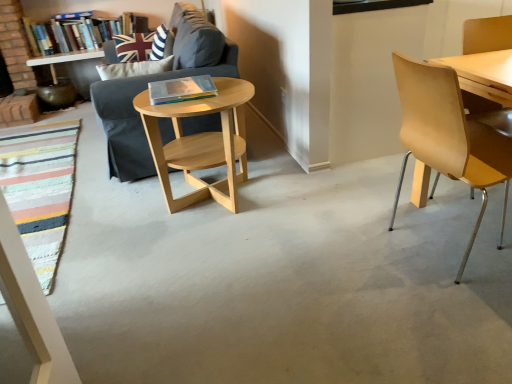
I want to click on hardcover book at upper left, which is the first book in top-to-bottom order, so click(x=79, y=31).

Measure the distance between point (435,139) and camera.

They are 1.45 meters apart.

What do you see at coordinates (201, 143) in the screenshot? This screenshot has height=384, width=512. I see `light wood/woodenobject at center` at bounding box center [201, 143].

The image size is (512, 384). What are the coordinates of `light wood/woodenobject at center` in the screenshot? It's located at tap(201, 143).

Find the location of `union jack fabric pillow at upper left`. union jack fabric pillow at upper left is located at coordinates (142, 46).

The image size is (512, 384). I want to click on chair below the light wood/woodenobject at center (from the image's perspective), so click(x=448, y=136).

Is there a large distance between light wood/woodenobject at center and light brown wood chair at right?

Indeed, light wood/woodenobject at center is not near light brown wood chair at right.

Can light brown wood chair at right be found inside light wood/woodenobject at center?

No, light brown wood chair at right is located outside of light wood/woodenobject at center.

Is hardcover book at center, acting as the 2th book starting from the top, further to camera compared to dark gray fabric couch at center-left?

No, hardcover book at center, acting as the 2th book starting from the top, is closer to the camera.

From the image's perspective, which is above, hardcover book at center, marked as the second book in a left-to-right arrangement, or dark gray fabric couch at center-left?

From the image's view, dark gray fabric couch at center-left is above.

Does hardcover book at center, arranged as the 1th book when viewed from the right, turn towards dark gray fabric couch at center-left?

No, hardcover book at center, arranged as the 1th book when viewed from the right, is not turned towards dark gray fabric couch at center-left.

Which point is more distant from viewer, [190,178] or [175,97]?

The point [190,178] is farther from the camera.

From a real-world perspective, which object stands above the other?

hardcover book at center, which is counted as the 2th book, starting from the back, from a real-world perspective.

From the image's perspective, does light wood/woodenobject at center appear lower than hardcover book at center, which is the 1th book from front to back?

Yes.

Are light wood/woodenobject at center and hardcover book at center, which is counted as the 2th book, starting from the back, far apart?

No, there isn't a large distance between light wood/woodenobject at center and hardcover book at center, which is counted as the 2th book, starting from the back.

Is light brown wood chair at right not near hardcover book at center, arranged as the 1th book when viewed from the right?

light brown wood chair at right is positioned a significant distance from hardcover book at center, arranged as the 1th book when viewed from the right.

From the image's perspective, between light brown wood chair at right and hardcover book at center, marked as the second book in a left-to-right arrangement, who is located below?

light brown wood chair at right appears lower in the image.

Can you confirm if light brown wood chair at right is positioned to the left of hardcover book at center, marked as the second book in a left-to-right arrangement?

Incorrect, light brown wood chair at right is not on the left side of hardcover book at center, marked as the second book in a left-to-right arrangement.

Consider the image. Considering the sizes of light brown wood chair at right and hardcover book at center, the first book in the bottom-to-top sequence, in the image, is light brown wood chair at right wider or thinner than hardcover book at center, the first book in the bottom-to-top sequence,?

light brown wood chair at right is wider than hardcover book at center, the first book in the bottom-to-top sequence.

Is light wood/woodenobject at center not close to dark gray fabric couch at center-left?

Actually, light wood/woodenobject at center and dark gray fabric couch at center-left are a little close together.

Which object is positioned more to the right, light wood/woodenobject at center or dark gray fabric couch at center-left?

Positioned to the right is light wood/woodenobject at center.

Could you tell me if light wood/woodenobject at center is facing dark gray fabric couch at center-left?

No, light wood/woodenobject at center does not turn towards dark gray fabric couch at center-left.

Are dark gray fabric couch at center-left and light wood/woodenobject at center located far from each other?

No, dark gray fabric couch at center-left is not far away from light wood/woodenobject at center.

Where is `table below the dark gray fabric couch at center-left (from the image's perspective)`? table below the dark gray fabric couch at center-left (from the image's perspective) is located at coordinates (201, 143).

Is light wood/woodenobject at center completely or partially inside dark gray fabric couch at center-left?

No, light wood/woodenobject at center is not inside dark gray fabric couch at center-left.

Is point (146, 149) farther from viewer compared to point (225, 109)?

Yes.

From the image's perspective, does light brown wood chair at right appear higher than light wood/woodenobject at center?

No.

Can you confirm if light brown wood chair at right is positioned to the right of light wood/woodenobject at center?

Correct, you'll find light brown wood chair at right to the right of light wood/woodenobject at center.

Would you consider light brown wood chair at right to be distant from light wood/woodenobject at center?

Yes, light brown wood chair at right and light wood/woodenobject at center are located far from each other.

The height and width of the screenshot is (384, 512). I want to click on table behind the light brown wood chair at right, so click(201, 143).

At what (x,y) coordinates should I click in order to perform the action: click on studio couch above the hardcover book at center, arranged as the 1th book when viewed from the right (from the image's perspective). Please return your answer as a coordinate pair (x, y). Looking at the image, I should click on (157, 80).

Based on their spatial positions, is light brown wood chair at right or hardcover book at center, which is counted as the 2th book, starting from the back, further from light wood/woodenobject at center?

Among the two, light brown wood chair at right is located further to light wood/woodenobject at center.

Which object lies nearer to the anchor point light wood/woodenobject at center, light brown wood chair at right or union jack fabric pillow at upper left?

Based on the image, union jack fabric pillow at upper left appears to be nearer to light wood/woodenobject at center.

When comparing their distances from hardcover book at upper left, the 1th book when ordered from back to front, does light wood/woodenobject at center or union jack fabric pillow at upper left seem further?

light wood/woodenobject at center is positioned further to the anchor hardcover book at upper left, the 1th book when ordered from back to front.

Considering their positions, is light brown wood chair at right positioned further to hardcover book at upper left, which is the first book in left-to-right order, than light wood/woodenobject at center?

light brown wood chair at right.

When comparing their distances from union jack fabric pillow at upper left, does dark gray fabric couch at center-left or light wood/woodenobject at center seem further?

light wood/woodenobject at center.

Looking at the image, which one is located further to light brown wood chair at right, hardcover book at upper left, the 1th book when ordered from back to front, or union jack fabric pillow at upper left?

hardcover book at upper left, the 1th book when ordered from back to front, is positioned further to the anchor light brown wood chair at right.

When comparing their distances from dark gray fabric couch at center-left, does light wood/woodenobject at center or hardcover book at upper left, which is the first book in top-to-bottom order, seem further?

hardcover book at upper left, which is the first book in top-to-bottom order, is positioned further to the anchor dark gray fabric couch at center-left.

Looking at the image, which one is located further to dark gray fabric couch at center-left, hardcover book at center, acting as the 2th book starting from the top, or union jack fabric pillow at upper left?

union jack fabric pillow at upper left is positioned further to the anchor dark gray fabric couch at center-left.

Image resolution: width=512 pixels, height=384 pixels. I want to click on studio couch between light wood/woodenobject at center and hardcover book at upper left, the second book viewed from the front, in the front-back direction, so click(157, 80).

Locate an element on the screen. The width and height of the screenshot is (512, 384). studio couch between light brown wood chair at right and union jack fabric pillow at upper left from front to back is located at coordinates (157, 80).

Where is `book between light wood/woodenobject at center and union jack fabric pillow at upper left along the z-axis`? Image resolution: width=512 pixels, height=384 pixels. book between light wood/woodenobject at center and union jack fabric pillow at upper left along the z-axis is located at coordinates (x=181, y=89).

At what (x,y) coordinates should I click in order to perform the action: click on table between light brown wood chair at right and hardcover book at upper left, the second book viewed from the front, from front to back. Please return your answer as a coordinate pair (x, y). Looking at the image, I should click on (201, 143).